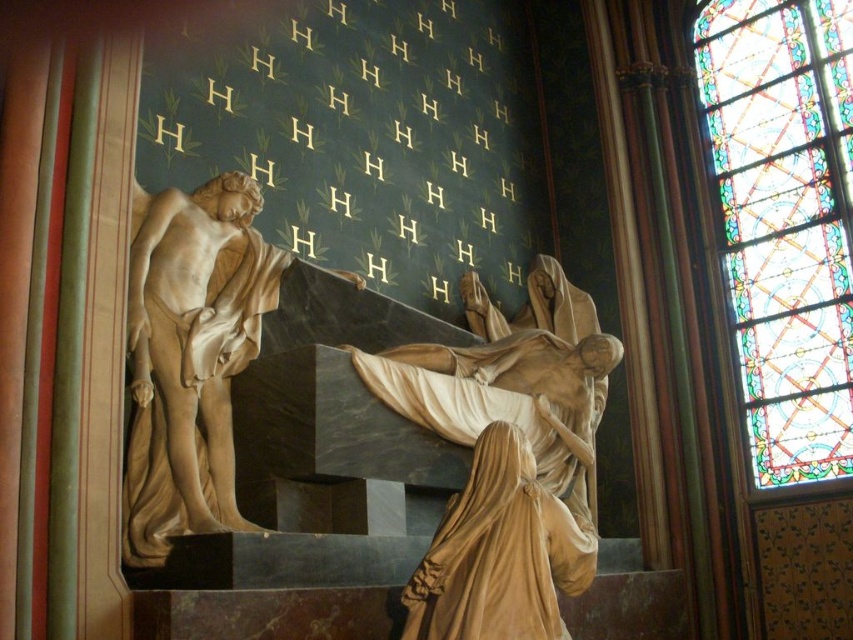
Based on the photo, you are an art conservator assessing the sculpture in the cathedral. You notice the marble statue at center and the smooth beige cloth at center. Which object takes up more space in the scene?

The marble statue at center is larger in size than the smooth beige cloth at center, so it takes up more space in the scene.

You are an art conservator assessing the lighting in the cathedral. The stained glass at upper right and the smooth beige cloth at center are both important elements. Based on their sizes, which one might cast a larger shadow?

The stained glass at upper right is taller than the smooth beige cloth at center, so it would cast a larger shadow.

You are an art student examining the church interior. You notice the stained glass at upper right and the marble statue at center. Which object is taller?

The stained glass at upper right is taller than the marble statue at center.